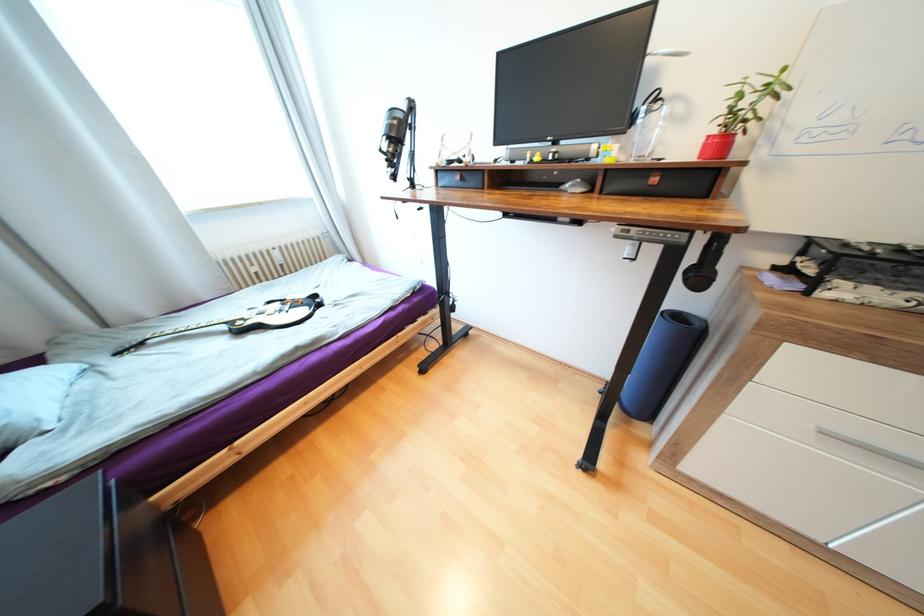
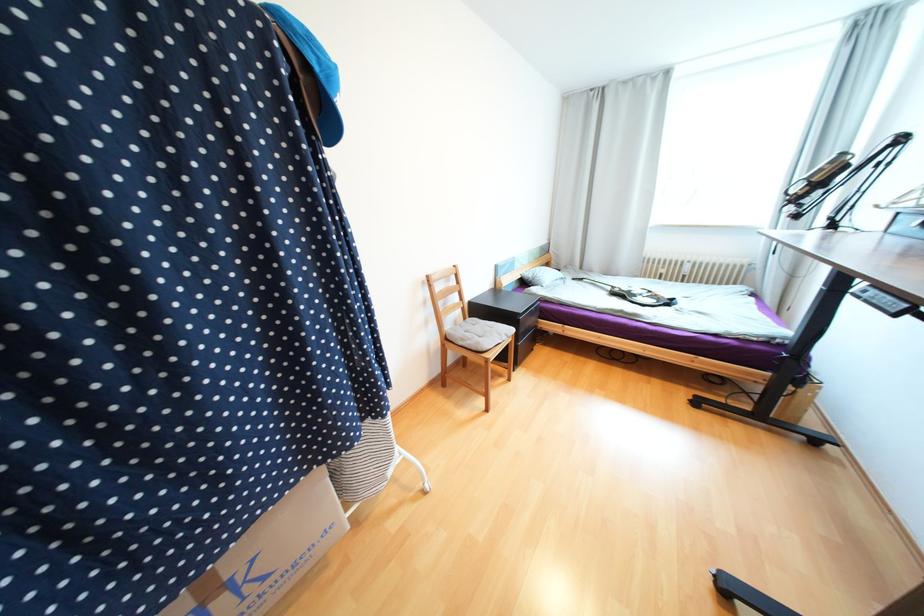
Where in the second image is the point corresponding to (x=229, y=328) from the first image?

(614, 288)